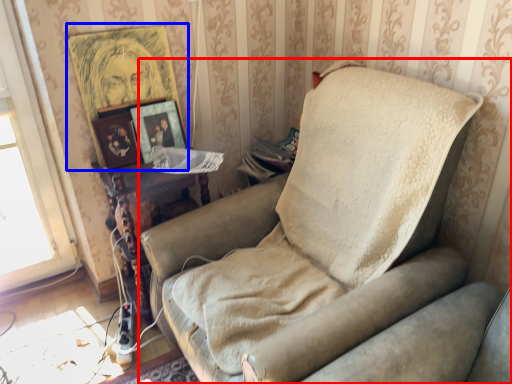
Question: Among these objects, which one is farthest to the camera, studio couch (highlighted by a red box) or picture frame (highlighted by a blue box)?

Choices:
 (A) studio couch
 (B) picture frame

Answer: (B)